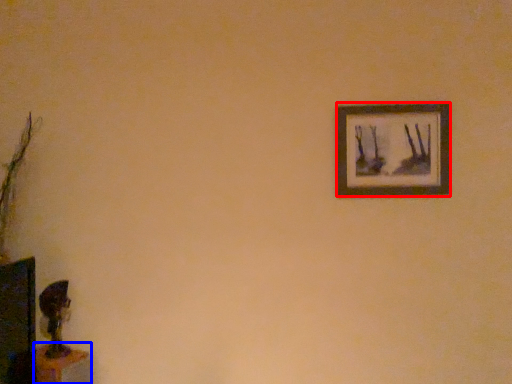
Question: Which object appears closest to the camera in this image, picture frame (highlighted by a red box) or table (highlighted by a blue box)?

Choices:
 (A) picture frame
 (B) table

Answer: (B)